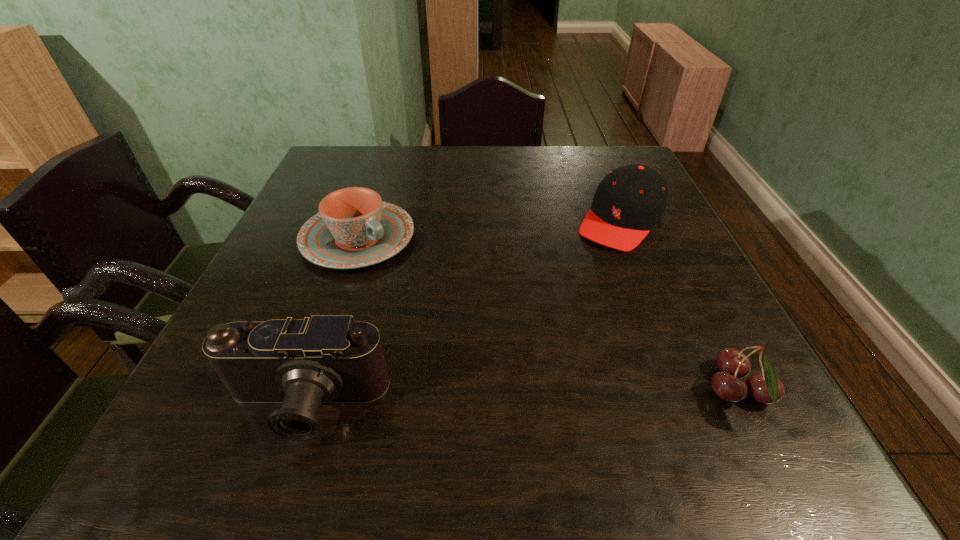
At what (x,y) coordinates should I click in order to perform the action: click on vacant space at the left edge of the desktop. Please return your answer as a coordinate pair (x, y). Looking at the image, I should click on (307, 199).

The height and width of the screenshot is (540, 960). In the image, there is a desktop. Find the location of `vacant space at the far right corner`. vacant space at the far right corner is located at coordinates (636, 158).

At what (x,y) coordinates should I click in order to perform the action: click on free space at the near right corner of the desktop. Please return your answer as a coordinate pair (x, y). The image size is (960, 540). Looking at the image, I should click on (684, 368).

Image resolution: width=960 pixels, height=540 pixels. What are the coordinates of `free space between the cap and the chinaware` in the screenshot? It's located at (490, 230).

The image size is (960, 540). Identify the location of empty space between the camera and the cherry. (521, 399).

Where is `blank region between the camera and the cap`? blank region between the camera and the cap is located at coordinates (463, 313).

Locate an element on the screen. The width and height of the screenshot is (960, 540). free space between the cherry and the cap is located at coordinates (681, 307).

You are a GUI agent. You are given a task and a screenshot of the screen. Output one action in this format:
    pyautogui.click(x=<x>, y=<y>)
    Task: Click on the vacant area between the camera and the cherry
    The width and height of the screenshot is (960, 540).
    Given the screenshot: What is the action you would take?
    pyautogui.click(x=521, y=399)

The width and height of the screenshot is (960, 540). I want to click on vacant area that lies between the camera and the cap, so click(463, 313).

Locate an element on the screen. The image size is (960, 540). free space between the chinaware and the cherry is located at coordinates (549, 315).